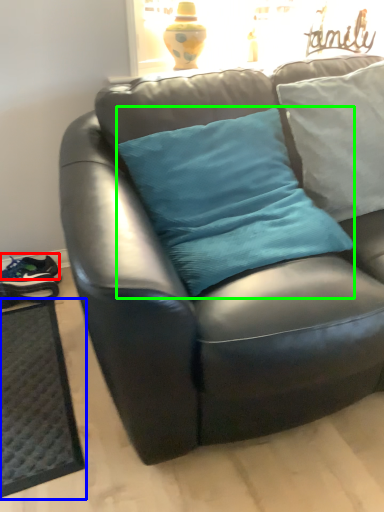
Question: Which object is the farthest from running shoe (highlighted by a red box)? Choose among these: doormat (highlighted by a blue box) or pillow (highlighted by a green box).

Choices:
 (A) doormat
 (B) pillow

Answer: (B)